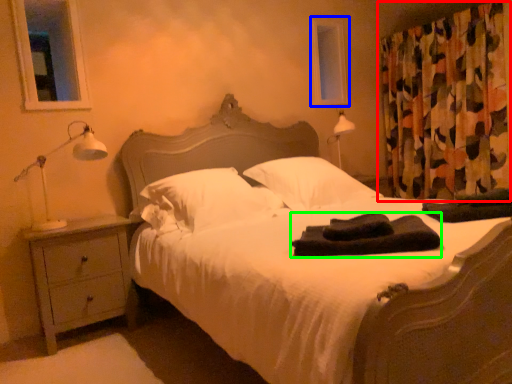
Question: Considering the real-world distances, which object is closest to curtain (highlighted by a red box)? window screen (highlighted by a blue box) or material (highlighted by a green box).

Choices:
 (A) window screen
 (B) material

Answer: (A)